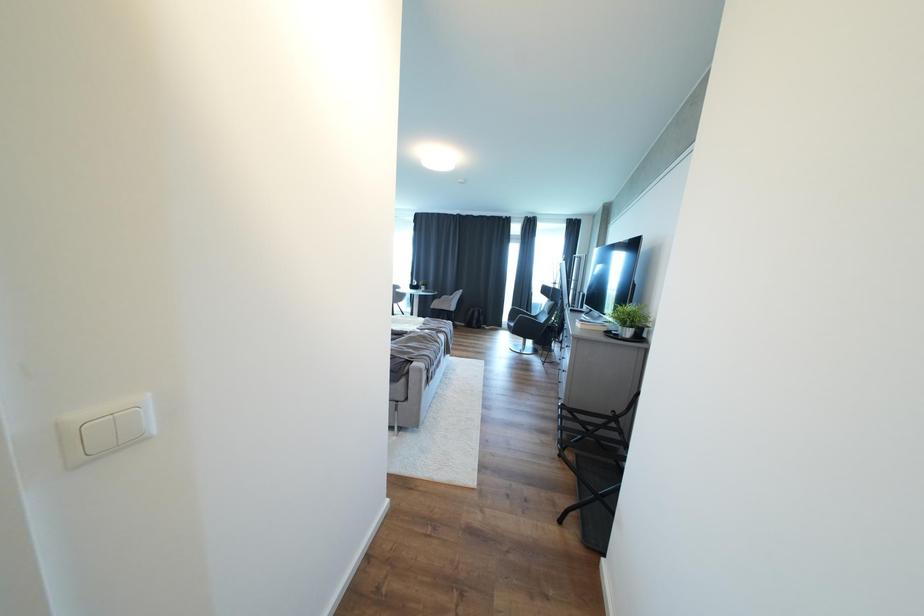
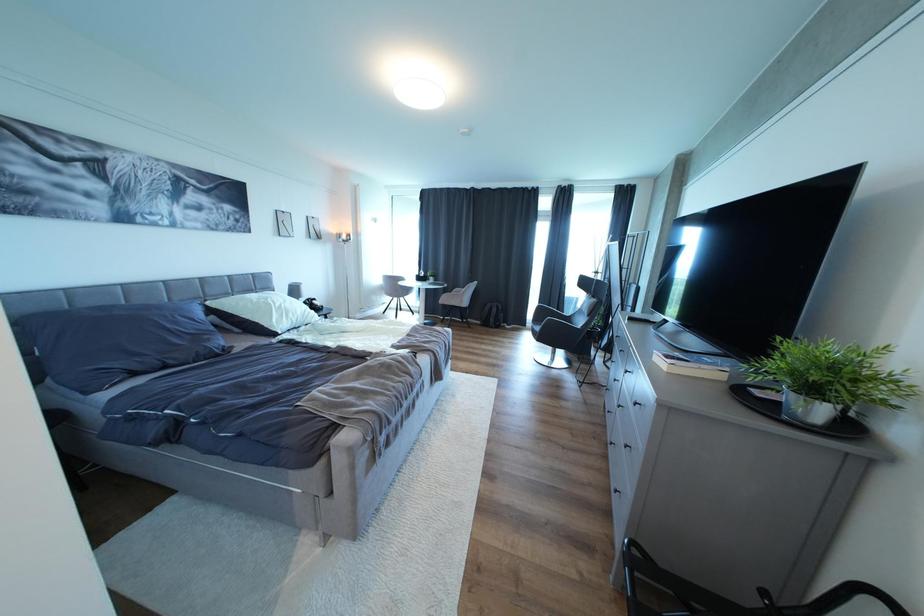
Question: The camera is either moving clockwise (left) or counter-clockwise (right) around the object. The first image is from the beginning of the video and the second image is from the end. Is the camera moving left or right when shooting the video?

Choices:
 (A) Left
 (B) Right

Answer: (B)